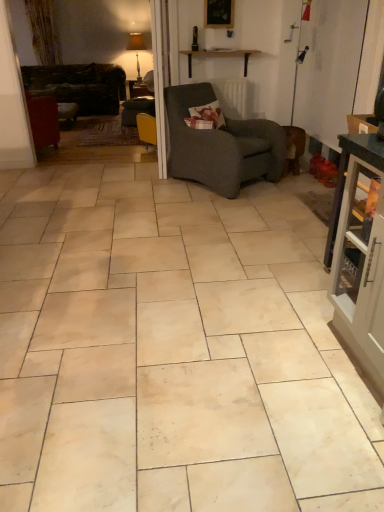
Question: Can you confirm if matte gray cabinet at right is taller than dark gray textured armchair at center?

Choices:
 (A) no
 (B) yes

Answer: (B)

Question: From the image's perspective, is matte gray cabinet at right beneath dark gray textured armchair at center?

Choices:
 (A) no
 (B) yes

Answer: (B)

Question: From a real-world perspective, is matte gray cabinet at right located beneath dark gray textured armchair at center?

Choices:
 (A) yes
 (B) no

Answer: (B)

Question: Is matte gray cabinet at right not close to dark gray textured armchair at center?

Choices:
 (A) yes
 (B) no

Answer: (A)

Question: Is matte gray cabinet at right located outside dark gray textured armchair at center?

Choices:
 (A) no
 (B) yes

Answer: (B)

Question: From the image's perspective, relative to dark gray textured armchair at center, is dark brown leather couch at left above or below?

Choices:
 (A) above
 (B) below

Answer: (A)

Question: Relative to dark gray textured armchair at center, is dark brown leather couch at left in front or behind?

Choices:
 (A) front
 (B) behind

Answer: (B)

Question: From a real-world perspective, is dark brown leather couch at left above or below dark gray textured armchair at center?

Choices:
 (A) above
 (B) below

Answer: (B)

Question: Is point 29,81 positioned closer to the camera than point 274,134?

Choices:
 (A) farther
 (B) closer

Answer: (A)

Question: Considering the positions of floral fabric pillow at center and matte white lampshade at upper center in the image, is floral fabric pillow at center taller or shorter than matte white lampshade at upper center?

Choices:
 (A) short
 (B) tall

Answer: (A)

Question: From the image's perspective, is floral fabric pillow at center positioned above or below matte white lampshade at upper center?

Choices:
 (A) below
 (B) above

Answer: (A)

Question: In the image, is floral fabric pillow at center positioned in front of or behind matte white lampshade at upper center?

Choices:
 (A) behind
 (B) front

Answer: (B)

Question: Is point (223, 118) positioned closer to the camera than point (142, 46)?

Choices:
 (A) closer
 (B) farther

Answer: (A)

Question: Considering the positions of point (365, 310) and point (193, 87), is point (365, 310) closer or farther from the camera than point (193, 87)?

Choices:
 (A) closer
 (B) farther

Answer: (A)

Question: Would you say matte gray cabinet at right is to the left or to the right of dark gray textured armchair at center in the picture?

Choices:
 (A) left
 (B) right

Answer: (B)